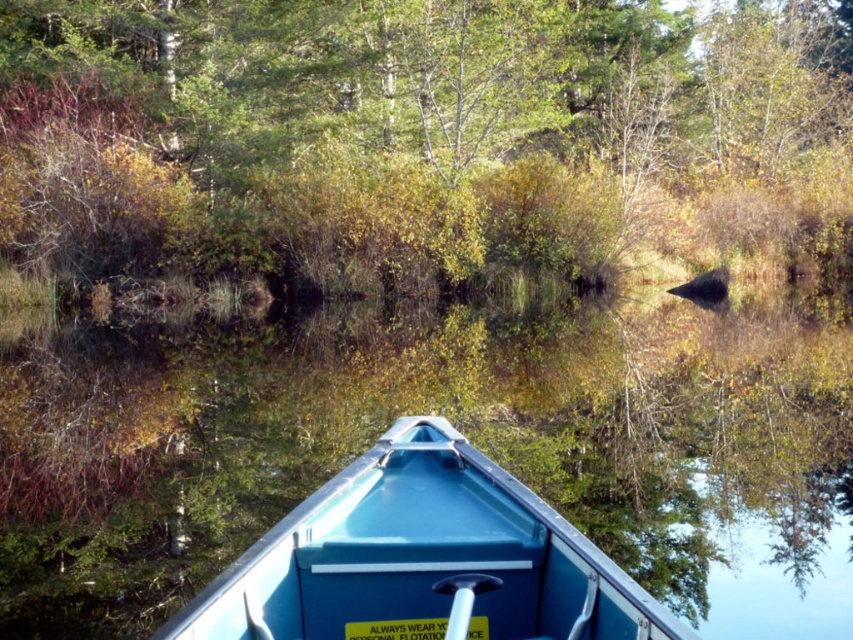
Is green leafy tree at upper center shorter than blue plastic boat at center?

Incorrect, green leafy tree at upper center's height does not fall short of blue plastic boat at center's.

Who is shorter, green leafy tree at upper center or blue plastic boat at center?

With less height is blue plastic boat at center.

Does point (131, 259) lie behind point (415, 435)?

Yes, it is.

Find the location of a particular element. This screenshot has height=640, width=853. green leafy tree at upper center is located at coordinates (416, 134).